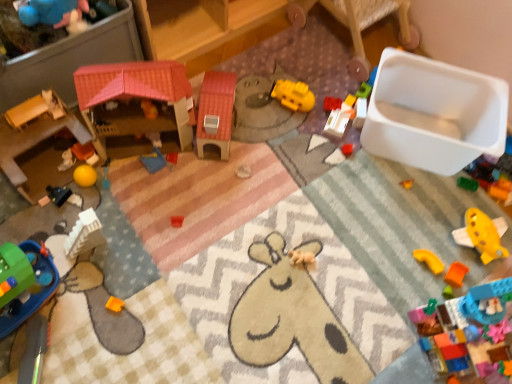
Find the location of `vacant space to the left of translucent blue plastic blocks at lower right, the third toy viewed from the right`. vacant space to the left of translucent blue plastic blocks at lower right, the third toy viewed from the right is located at coordinates (381, 327).